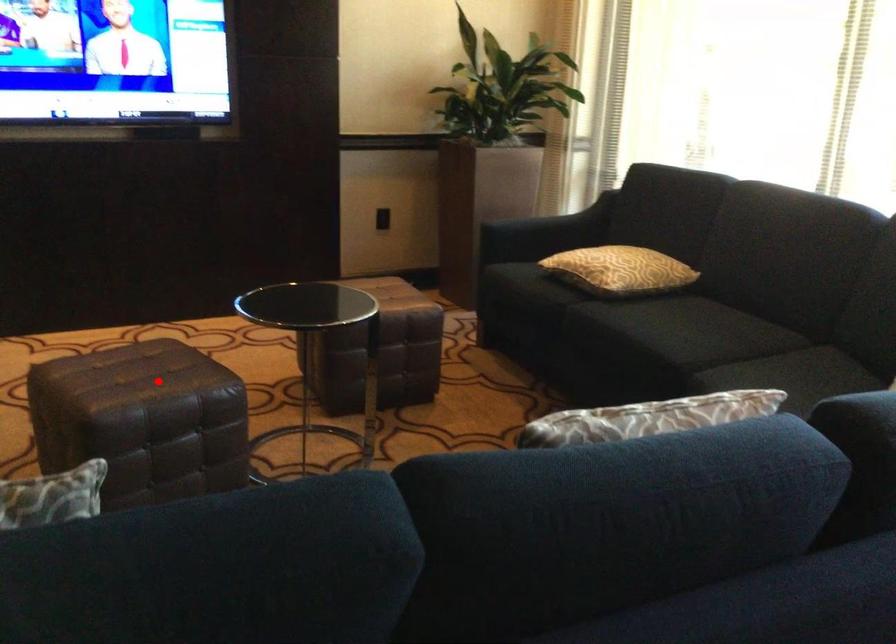
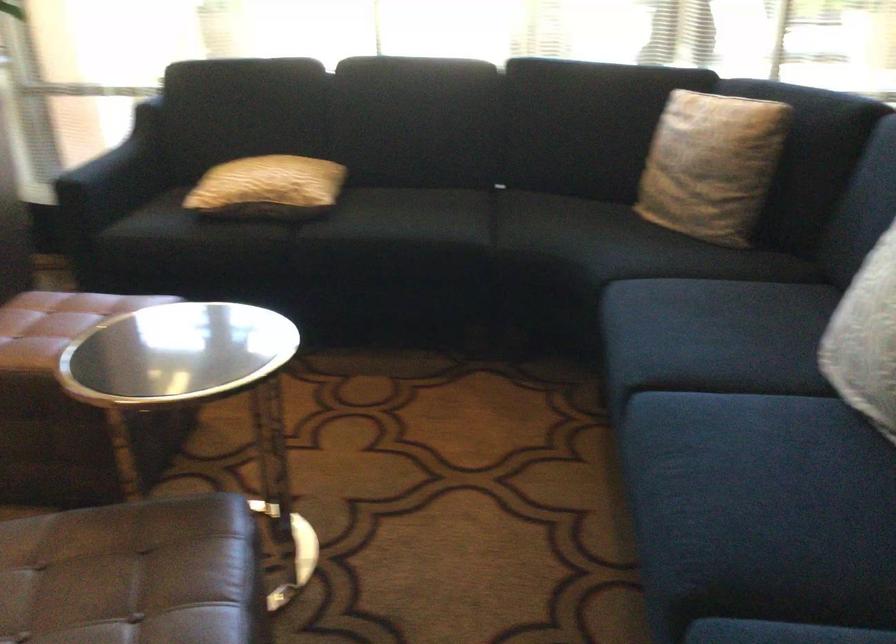
Question: I am providing you with two images of the same scene from different viewpoints. In image1, a red point is highlighted. Considering the same 3D point in image2, which of the following is correct?

Choices:
 (A) It is closer
 (B) It is farther

Answer: (A)